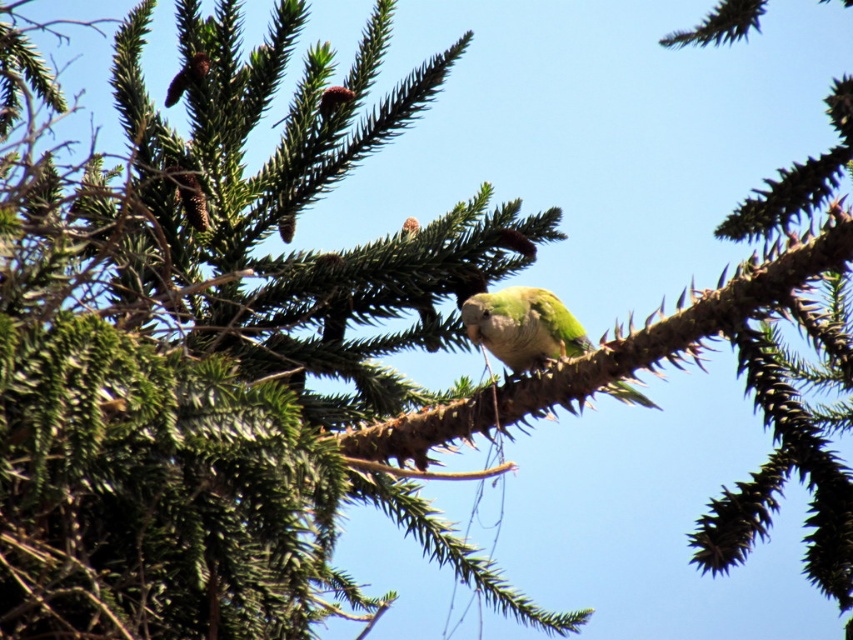
You are a birdwatcher trying to observe the green matte parrot at center. You notice there is a green textured branch at center in the way. Can you see the parrot clearly through the branch?

The green textured branch at center is much taller than the green matte parrot at center, so the parrot is likely obscured by the branch, making it difficult to see clearly through the branch.

You are a birdwatcher observing the green textured branch at center and the green matte parrot at center. Which object appears bigger in the image?

The green textured branch at center is larger in size than the green matte parrot at center.

You are a birdwatcher observing the scene. You notice two parrots in the image. Which parrot is closer to you, the green matte parrot at center or the green feathered parrot at upper left?

The green matte parrot at center is closer to you because it is positioned in front of the green feathered parrot at upper left.